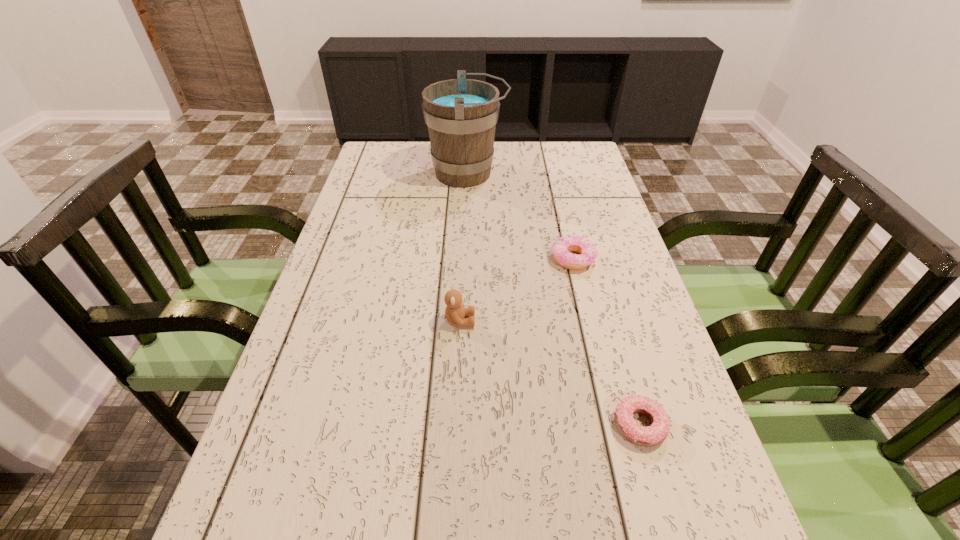
This screenshot has height=540, width=960. What are the coordinates of `blank space located 0.060m on the back of the taller doughnut` in the screenshot? It's located at (566, 231).

Find the location of a particular element. Image resolution: width=960 pixels, height=540 pixels. vacant area located 0.320m on the left of the shorter doughnut is located at coordinates (439, 425).

Identify the location of object situated at the far edge. Image resolution: width=960 pixels, height=540 pixels. (461, 114).

Find the location of a particular element. This screenshot has width=960, height=540. vacant space at the left edge of the desktop is located at coordinates (366, 365).

Locate an element on the screen. The height and width of the screenshot is (540, 960). vacant area at the right edge of the desktop is located at coordinates (643, 475).

Where is `free space at the far left corner of the desktop`? Image resolution: width=960 pixels, height=540 pixels. free space at the far left corner of the desktop is located at coordinates pyautogui.click(x=397, y=170).

This screenshot has width=960, height=540. Identify the location of vacant region at the far right corner. (559, 151).

Identify the location of vacant point located between the tallest object and the shorter doughnut. (554, 299).

Where is `vacant area that lies between the taller doughnut and the tallest object`? vacant area that lies between the taller doughnut and the tallest object is located at coordinates (x=520, y=216).

Where is `free spot between the tallest object and the shortest object`? free spot between the tallest object and the shortest object is located at coordinates (554, 299).